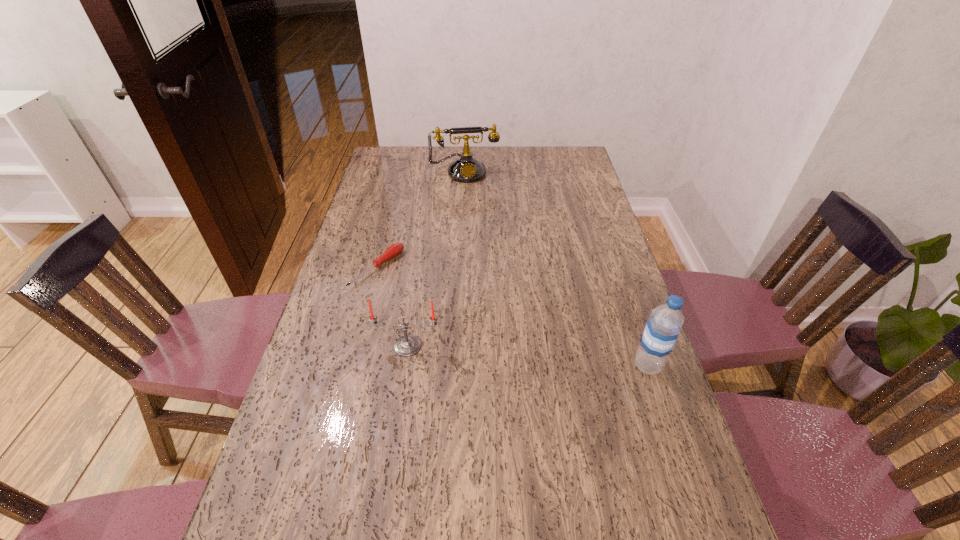
Locate an element on the screen. This screenshot has height=540, width=960. free space that satisfies the following two spatial constraints: 1. on the front side of the farthest object; 2. on the label of the rightmost object is located at coordinates (455, 366).

You are a GUI agent. You are given a task and a screenshot of the screen. Output one action in this format:
    pyautogui.click(x=<x>, y=<y>)
    Task: Click on the free space that satisfies the following two spatial constraints: 1. on the back side of the screwdriver; 2. on the left side of the farthest object
    The height and width of the screenshot is (540, 960).
    Given the screenshot: What is the action you would take?
    pyautogui.click(x=402, y=171)

Where is `free space that satisfies the following two spatial constraints: 1. on the front-facing side of the candle; 2. on the label of the water bottle`? free space that satisfies the following two spatial constraints: 1. on the front-facing side of the candle; 2. on the label of the water bottle is located at coordinates (405, 366).